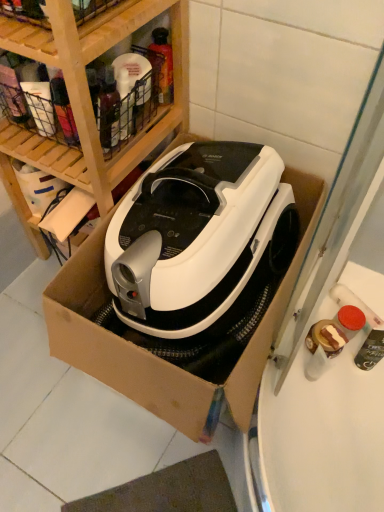
Question: From a real-world perspective, is white cardboard box at center above or below wooden at upper left?

Choices:
 (A) above
 (B) below

Answer: (B)

Question: Is white cardboard box at center bigger or smaller than wooden at upper left?

Choices:
 (A) small
 (B) big

Answer: (B)

Question: Estimate the real-world distances between objects in this image. Which object is farther from the translucent plastic spray bottle at upper center?

Choices:
 (A) wooden at upper left
 (B) white cardboard box at center

Answer: (B)

Question: Which is farther from the translucent plastic spray bottle at upper center?

Choices:
 (A) white cardboard box at center
 (B) wooden at upper left

Answer: (A)